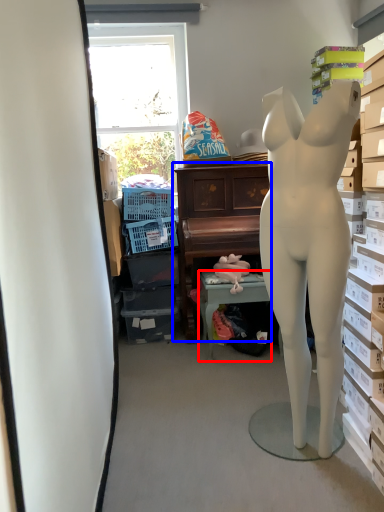
Question: Which point is closer to the camera, table (highlighted by a red box) or furniture (highlighted by a blue box)?

Choices:
 (A) table
 (B) furniture

Answer: (A)